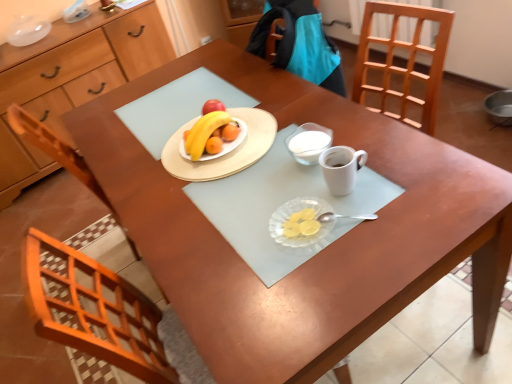
Identify the location of vacant area that lies between matte wooden plate at center and white glass bowl at center. The width and height of the screenshot is (512, 384). (260, 173).